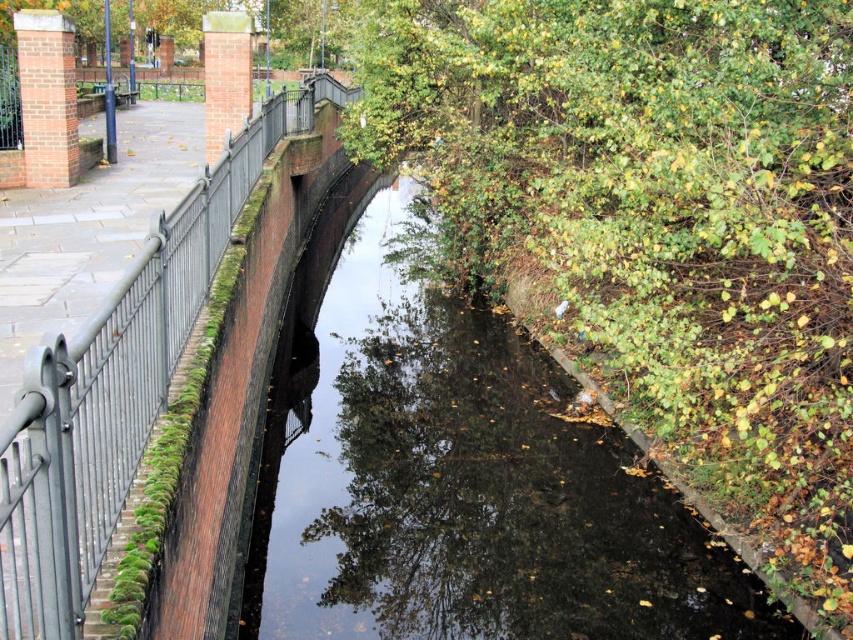
You are a painter standing at the edge of the canal near the metallic gray fence at left. You want to paint the green leafy tree at upper right. Which object will you need to look over to see the entire tree?

You will need to look over the metallic gray fence at left to see the entire green leafy tree at upper right because the tree is taller than the fence.

You are a painter setting up your easel to capture the canal scene. You want to focus on the green leafy tree at upper right and the metallic gray fence at left in your painting. Which object should you position wider in your artwork to accurately represent their sizes as seen in the scene?

The green leafy tree at upper right should be positioned wider in the painting because its width surpasses that of the metallic gray fence at left.